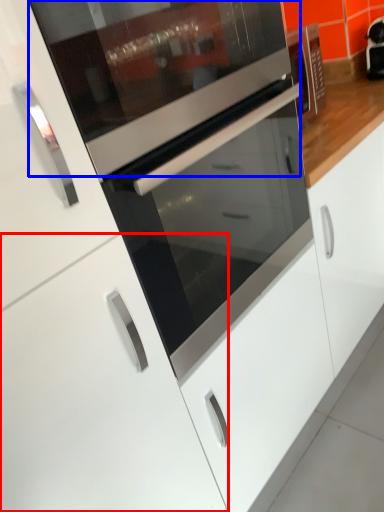
Question: Which object is closer to the camera taking this photo, cabinetry (highlighted by a red box) or appliance (highlighted by a blue box)?

Choices:
 (A) cabinetry
 (B) appliance

Answer: (B)